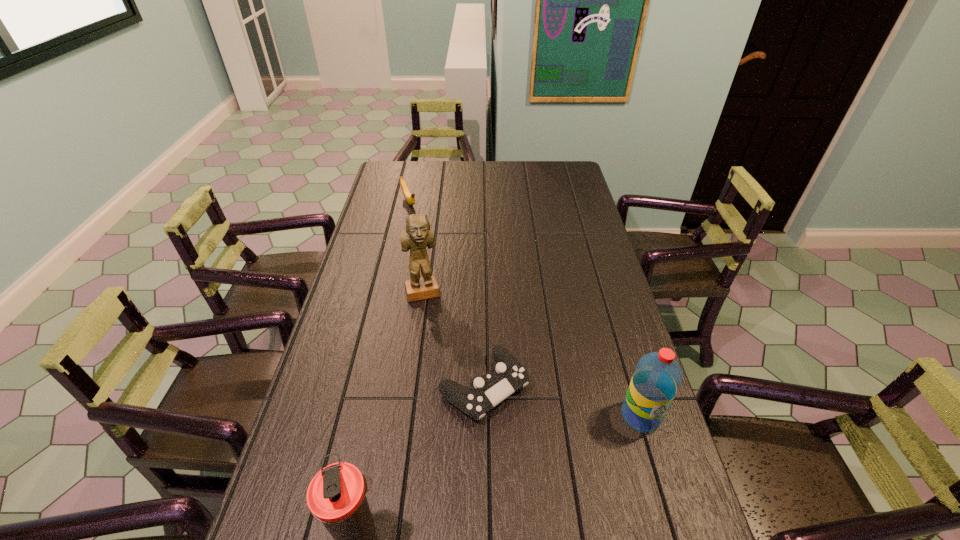
Locate an element on the screen. The width and height of the screenshot is (960, 540). water bottle is located at coordinates (657, 377).

Image resolution: width=960 pixels, height=540 pixels. Find the location of `the farthest object`. the farthest object is located at coordinates (410, 198).

Find the location of a particular element. Image resolution: width=960 pixels, height=540 pixels. the tallest object is located at coordinates (417, 236).

What are the coordinates of `figurine` in the screenshot? It's located at pos(417,236).

Where is `the second object from right to left`? This screenshot has width=960, height=540. the second object from right to left is located at coordinates (507, 375).

You are a GUI agent. You are given a task and a screenshot of the screen. Output one action in this format:
    pyautogui.click(x=<x>, y=<y>)
    Task: Click on the free space located 0.070m on the front label of the rightmost object
    The width and height of the screenshot is (960, 540).
    Given the screenshot: What is the action you would take?
    pyautogui.click(x=655, y=462)

Find the location of a particular element. This screenshot has height=540, width=960. vacant space located 0.270m at the stem of the banana is located at coordinates (431, 250).

Image resolution: width=960 pixels, height=540 pixels. Find the location of `free space located at the stem of the banana`. free space located at the stem of the banana is located at coordinates (425, 240).

The height and width of the screenshot is (540, 960). Identify the location of free region located 0.090m at the stem of the banana. point(417,225).

You are a GUI agent. You are given a task and a screenshot of the screen. Output one action in this format:
    pyautogui.click(x=<x>, y=<y>)
    Task: Click on the free space located 0.060m on the front-facing side of the figurine
    
    Given the screenshot: What is the action you would take?
    pyautogui.click(x=430, y=315)